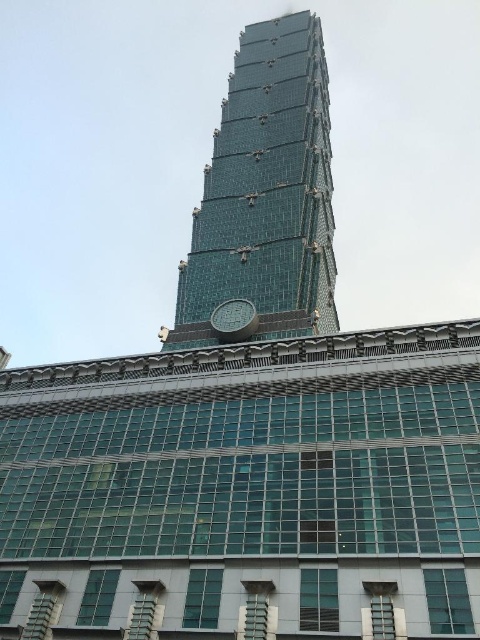
Question: Can you confirm if transparent glass tower at center is positioned below metallic clock at center?

Choices:
 (A) no
 (B) yes

Answer: (A)

Question: Among these objects, which one is nearest to the camera?

Choices:
 (A) transparent glass tower at center
 (B) metallic clock at center

Answer: (A)

Question: Does transparent glass tower at center appear on the right side of metallic clock at center?

Choices:
 (A) yes
 (B) no

Answer: (A)

Question: Which of the following is the farthest from the observer?

Choices:
 (A) metallic clock at center
 (B) transparent glass tower at center

Answer: (A)

Question: Can you confirm if transparent glass tower at center is smaller than metallic clock at center?

Choices:
 (A) yes
 (B) no

Answer: (B)